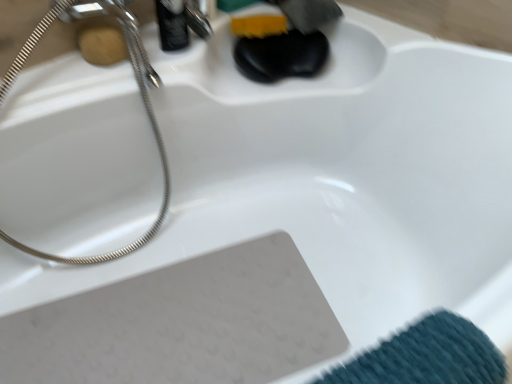
Question: From their relative heights in the image, would you say wooden soap at upper left is taller or shorter than polished chrome faucet at upper center?

Choices:
 (A) tall
 (B) short

Answer: (B)

Question: Which is correct: wooden soap at upper left is inside polished chrome faucet at upper center, or outside of it?

Choices:
 (A) inside
 (B) outside

Answer: (B)

Question: Based on their relative distances, which object is nearer to the satin nickel shower head at upper left?

Choices:
 (A) wooden soap at upper left
 (B) polished chrome faucet at upper center

Answer: (A)

Question: Based on their relative distances, which object is farther from the wooden soap at upper left?

Choices:
 (A) satin nickel shower head at upper left
 (B) polished chrome faucet at upper center

Answer: (A)